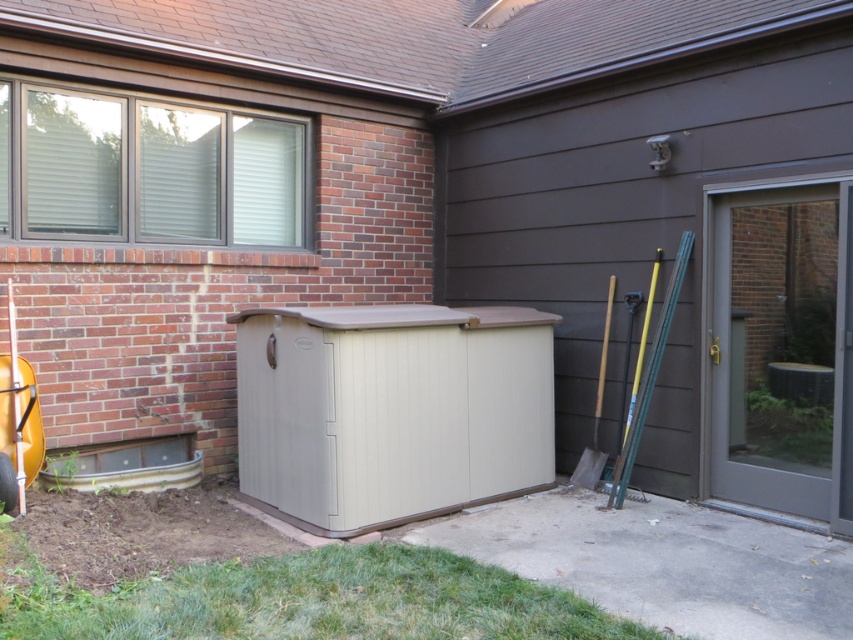
You are a delivery person trying to place a package in the wooden shovel at right. However, the matte gray screen door at right is blocking your path. Can you move the shovel without moving the door?

The matte gray screen door at right is in front of the wooden shovel at right, meaning the shovel is behind the door. Since the door is blocking access, you would need to move the door to reach the shovel.

You are a delivery person trying to deliver a package to the house. You see the matte gray screen door at right and the wooden shovel at right. Which one is wider?

The matte gray screen door at right is wider than the wooden shovel at right because its width surpasses that of the wooden shovel at right.

You are standing in front of the residential building and want to take a photo. There are two points marked on the building wall. Which point, point (817, 508) or point (608, 296), is closer to your camera lens?

Point (817, 508) is closer to the camera than point (608, 296).